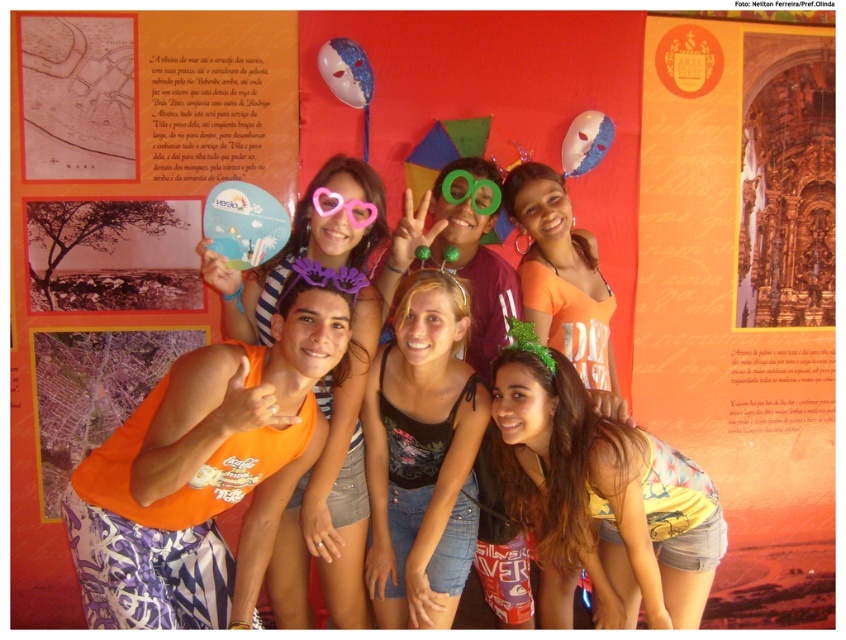
Which is below, orange cotton tank top at center or pink plastic heart-shaped goggles at center?

orange cotton tank top at center is lower down.

What are the coordinates of `orange cotton tank top at center` in the screenshot? It's located at (563, 282).

The height and width of the screenshot is (640, 846). Find the location of `orange cotton tank top at center`. orange cotton tank top at center is located at coordinates (563, 282).

Can you confirm if denim shorts at center is taller than orange fabric at center?

No.

Looking at this image, does denim shorts at center appear under orange fabric at center?

Correct, denim shorts at center is located below orange fabric at center.

The width and height of the screenshot is (846, 640). What do you see at coordinates (423, 456) in the screenshot?
I see `denim shorts at center` at bounding box center [423, 456].

Where is `denim shorts at center`? The image size is (846, 640). denim shorts at center is located at coordinates (423, 456).

Does orange fabric at center have a smaller size compared to green plastic goggles at center?

No, orange fabric at center is not smaller than green plastic goggles at center.

Does point (257, 292) come closer to viewer compared to point (481, 212)?

Yes, it is.

The height and width of the screenshot is (640, 846). Find the location of `orange fabric at center`. orange fabric at center is located at coordinates (330, 499).

At what (x,y) coordinates should I click in order to perform the action: click on orange fabric at center. Please return your answer as a coordinate pair (x, y). This screenshot has height=640, width=846. Looking at the image, I should click on (330, 499).